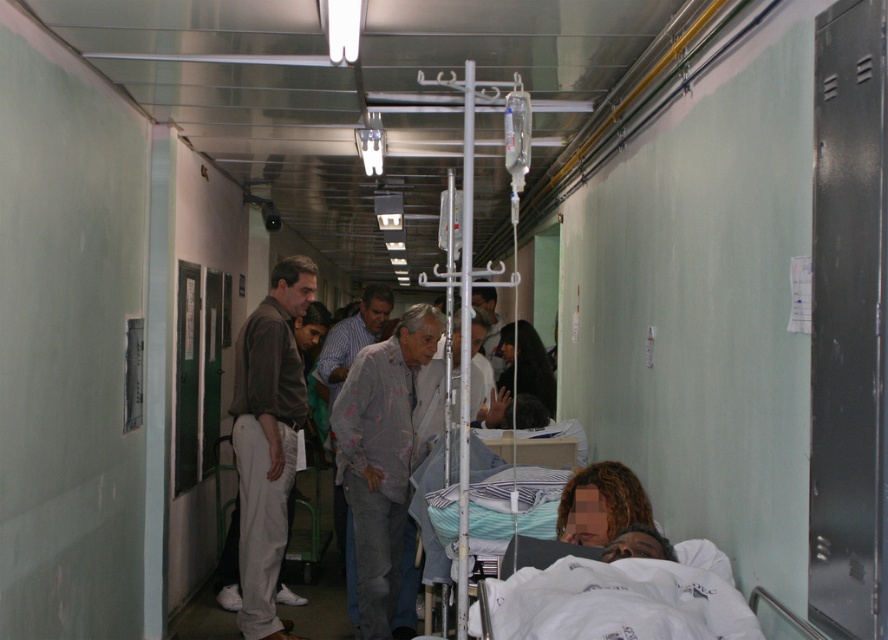
You are a nurse in the hospital corridor and need to locate the light brown fabric pants at left. Where exactly should you look?

You should look at point (x=268, y=440) to find the light brown fabric pants at left.

You are a nurse with a medical cart that is 1.5 meters wide. You need to move from the entrance to the patient in the hospital bed. Is there enough space between the light brown fabric pants at left and dark brown hair at center for your cart to pass through?

The distance between the light brown fabric pants at left and dark brown hair at center is 1.88 meters. Since your cart is 1.5 meters wide, there is sufficient space for the cart to pass through the corridor between these two objects.